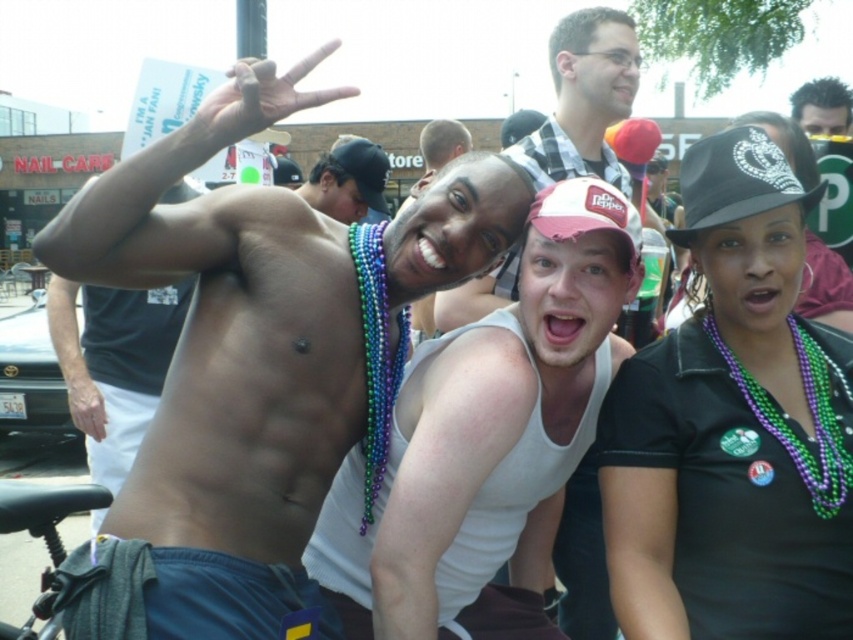
You are taking a photo of the black sequined baseball cap at upper right and the green beaded necklace at lower right. Which object will appear larger in the photo?

The black sequined baseball cap at upper right appears larger in the photo because it is positioned over the green beaded necklace at lower right, indicating it is closer to the camera.

You are a photographer at this event and want to ensure that both the black sequined baseball cap at upper right and the green beaded necklace at lower right are clearly visible in your photo. Considering their heights, which object should you focus on first to ensure proper framing?

The black sequined baseball cap at upper right is shorter than the green beaded necklace at lower right. To ensure both are visible, focus on the taller object first, which is the green beaded necklace at lower right, then adjust the framing to include the shorter one.

You are a photographer at this event and want to capture a closeup of both the black matte hat at upper right and the green beaded necklace at lower right in the same frame. Given their sizes, which object should you zoom in more on to ensure both are clearly visible?

The black matte hat at upper right is larger in size than the green beaded necklace at lower right. To capture both clearly, you should zoom in more on the green beaded necklace at lower right to balance their sizes in the frame.